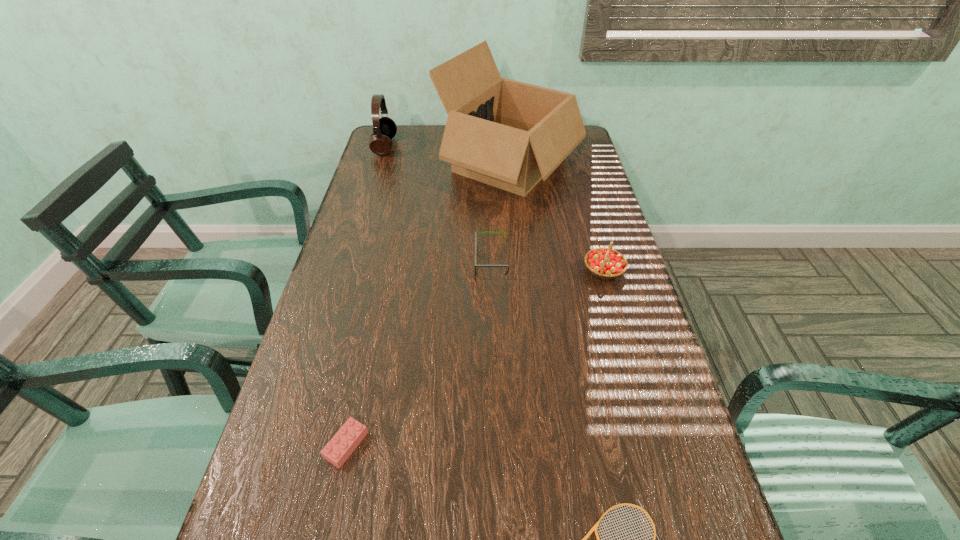
The image size is (960, 540). I want to click on object that is at the far left corner, so click(x=384, y=128).

Where is `object that is at the far right corner`? The height and width of the screenshot is (540, 960). object that is at the far right corner is located at coordinates (508, 134).

At what (x,y) coordinates should I click in order to perform the action: click on vacant point at the left edge. Please return your answer as a coordinate pair (x, y). Looking at the image, I should click on (365, 219).

Find the location of a particular element. free location at the right edge is located at coordinates click(x=644, y=338).

This screenshot has height=540, width=960. In order to click on vacant space at the far left corner of the desktop in this screenshot , I will do `click(398, 129)`.

Where is `empty space between the tallest object and the third shortest object`? empty space between the tallest object and the third shortest object is located at coordinates (501, 212).

You are a GUI agent. You are given a task and a screenshot of the screen. Output one action in this format:
    pyautogui.click(x=<x>, y=<y>)
    Task: Click on the empty space that is in between the box and the spectacles
    
    Given the screenshot: What is the action you would take?
    pyautogui.click(x=501, y=212)

The width and height of the screenshot is (960, 540). I want to click on vacant space that is in between the strawberry and the second tallest object, so click(494, 208).

This screenshot has width=960, height=540. I want to click on free point between the third tallest object and the tallest object, so click(x=557, y=217).

I want to click on vacant space that is in between the Lego and the box, so click(428, 303).